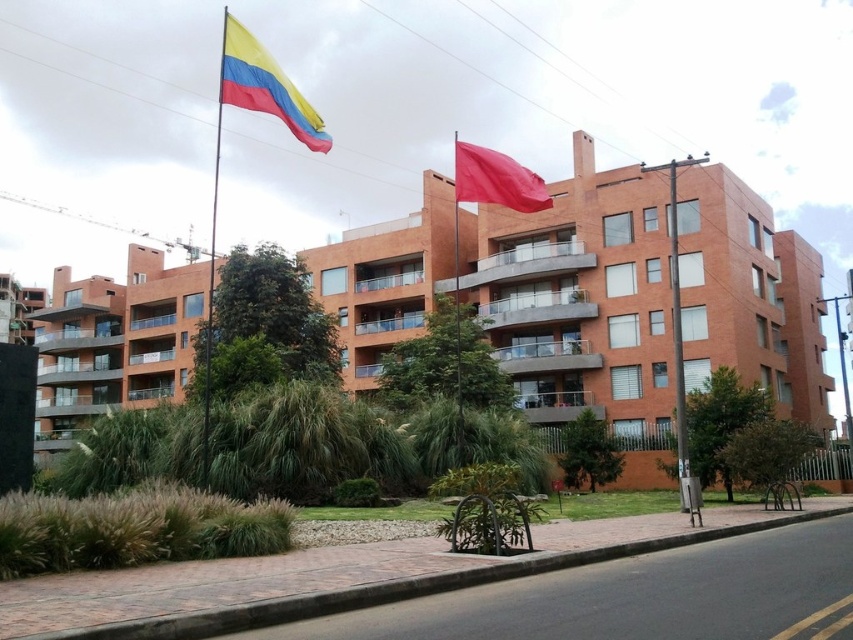
Is point (500, 193) farther from camera compared to point (215, 192)?

No, (500, 193) is closer to viewer.

Looking at this image, can you confirm if red matte flag at upper center is positioned below metallic flag pole at upper left?

Yes, red matte flag at upper center is below metallic flag pole at upper left.

Who is more forward, (469, 172) or (219, 134)?

Positioned in front is point (469, 172).

You are a GUI agent. You are given a task and a screenshot of the screen. Output one action in this format:
    pyautogui.click(x=<x>, y=<y>)
    Task: Click on the red matte flag at upper center
    This screenshot has width=853, height=640.
    Given the screenshot: What is the action you would take?
    pyautogui.click(x=496, y=179)

Between point (469, 166) and point (688, 508), which one is positioned behind?

Point (688, 508)

Which is above, red matte flag at upper center or metallic gray pole at center?

metallic gray pole at center is higher up.

What do you see at coordinates (496, 179) in the screenshot? I see `red matte flag at upper center` at bounding box center [496, 179].

Locate an element on the screen. The width and height of the screenshot is (853, 640). red matte flag at upper center is located at coordinates (496, 179).

Does brick building at center have a larger size compared to metallic flag pole at upper left?

Actually, brick building at center might be smaller than metallic flag pole at upper left.

Between brick building at center and metallic flag pole at upper left, which one appears on the left side from the viewer's perspective?

metallic flag pole at upper left

Is point (584, 355) closer to camera compared to point (219, 88)?

No.

This screenshot has width=853, height=640. Identify the location of brick building at center. (579, 296).